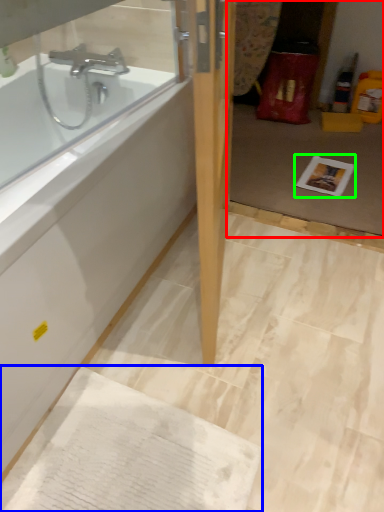
Question: Which is farther away from glass door (highlighted by a red box)? cardboard (highlighted by a blue box) or copy (highlighted by a green box)?

Choices:
 (A) cardboard
 (B) copy

Answer: (A)